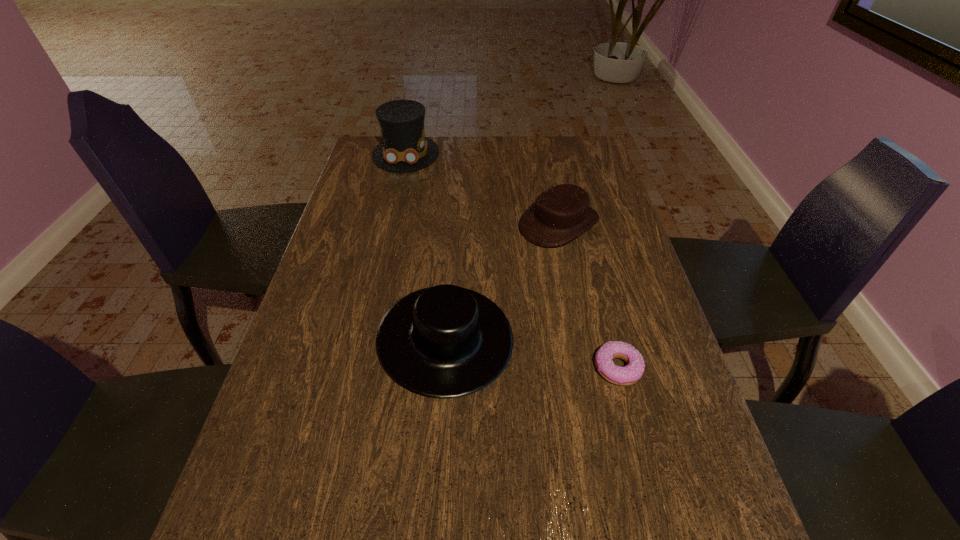
At what (x,y) coordinates should I click in order to perform the action: click on vacant space that is in between the shortest object and the tallest hat. Please return your answer as a coordinate pair (x, y). The height and width of the screenshot is (540, 960). Looking at the image, I should click on (512, 261).

Point out which object is positioned as the second nearest to the third shortest object. Please provide its 2D coordinates. Your answer should be formatted as a tuple, i.e. [(x, y)], where the tuple contains the x and y coordinates of a point satisfying the conditions above.

[(632, 372)]

Select which object appears as the second closest to the doughnut. Please provide its 2D coordinates. Your answer should be formatted as a tuple, i.e. [(x, y)], where the tuple contains the x and y coordinates of a point satisfying the conditions above.

[(560, 214)]

Select which hat is the second closest to the third shortest object. Please provide its 2D coordinates. Your answer should be formatted as a tuple, i.e. [(x, y)], where the tuple contains the x and y coordinates of a point satisfying the conditions above.

[(404, 148)]

Select which hat appears as the second closest to the doughnut. Please provide its 2D coordinates. Your answer should be formatted as a tuple, i.e. [(x, y)], where the tuple contains the x and y coordinates of a point satisfying the conditions above.

[(560, 214)]

I want to click on vacant area that satisfies the following two spatial constraints: 1. with goggles on the front of the tallest object; 2. on the left side of the third shortest object, so click(x=363, y=339).

Locate an element on the screen. blank space that satisfies the following two spatial constraints: 1. with goggles on the front of the second tallest hat; 2. on the right side of the tallest hat is located at coordinates (363, 339).

I want to click on free spot that satisfies the following two spatial constraints: 1. with goggles on the front of the tallest hat; 2. on the left side of the doughnut, so click(356, 368).

Where is `blank space that satisfies the following two spatial constraints: 1. with goggles on the front of the tallest object; 2. on the left side of the second nearest hat`? The height and width of the screenshot is (540, 960). blank space that satisfies the following two spatial constraints: 1. with goggles on the front of the tallest object; 2. on the left side of the second nearest hat is located at coordinates (390, 224).

Image resolution: width=960 pixels, height=540 pixels. Identify the location of vacant space that satisfies the following two spatial constraints: 1. with goggles on the front of the shortest object; 2. on the left side of the tallest hat. (356, 368).